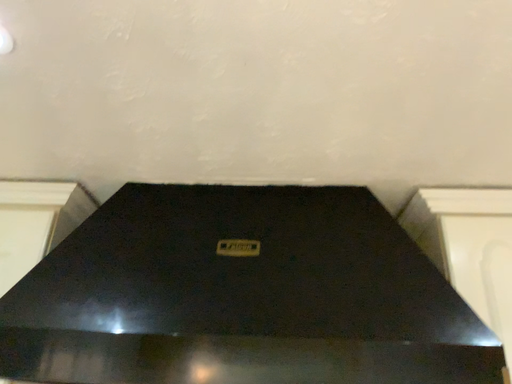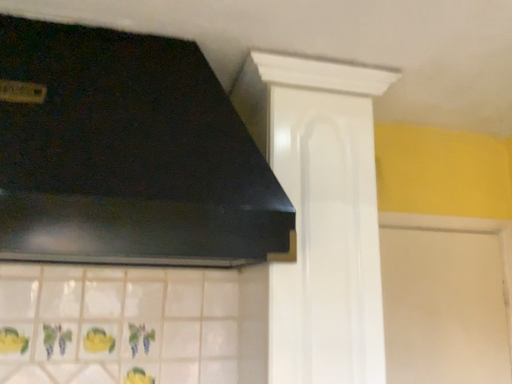
Question: Which way did the camera rotate in the video?

Choices:
 (A) rotated left
 (B) rotated right

Answer: (B)